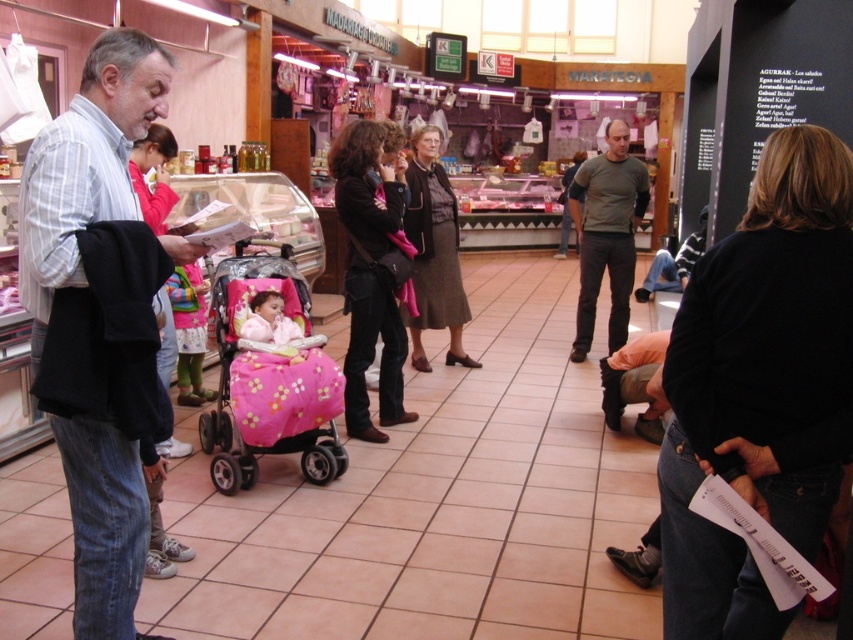
Consider the image. You are a photographer trying to capture a candid shot of the light blue striped shirt at left and the brown fabric skirt at center in the same frame. Based on their positions, which one would appear closer to the bottom of the photo?

The light blue striped shirt at left would appear closer to the bottom of the photo because it is positioned under the brown fabric skirt at center.

You are a photographer trying to capture the entire scene of the light blue striped shirt at left and the pink fabric baby carriage at center in one shot. Based on their sizes, will you need to adjust your camera to a wider angle to include both?

The light blue striped shirt at left has a smaller size compared to the pink fabric baby carriage at center. Therefore, to capture both in one shot, you might need to use a wider angle to accommodate the larger size of the pink fabric baby carriage at center.